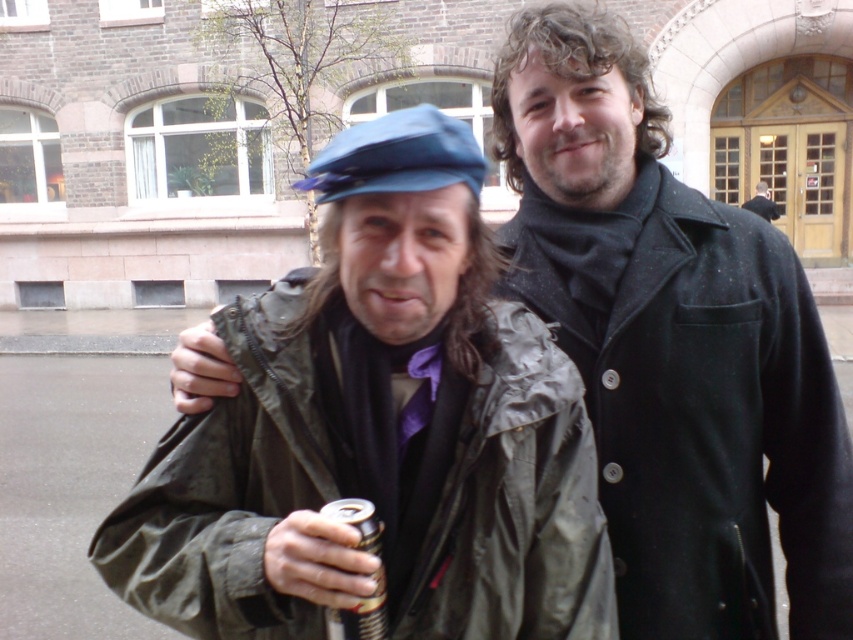
From the picture: Does olive-green fabric trench coat at center have a smaller size compared to dark gray wool coat at right?

Correct, olive-green fabric trench coat at center occupies less space than dark gray wool coat at right.

Between olive-green fabric trench coat at center and dark gray wool coat at right, which one has less height?

With less height is olive-green fabric trench coat at center.

Locate an element on the screen. The height and width of the screenshot is (640, 853). olive-green fabric trench coat at center is located at coordinates (519, 506).

Find the location of a particular element. The height and width of the screenshot is (640, 853). olive-green fabric trench coat at center is located at coordinates (519, 506).

Measure the distance from olive-green fabric trench coat at center to blue fabric cap at center.

The distance of olive-green fabric trench coat at center from blue fabric cap at center is 17.49 inches.

The height and width of the screenshot is (640, 853). What do you see at coordinates (519, 506) in the screenshot?
I see `olive-green fabric trench coat at center` at bounding box center [519, 506].

You are a GUI agent. You are given a task and a screenshot of the screen. Output one action in this format:
    pyautogui.click(x=<x>, y=<y>)
    Task: Click on the olive-green fabric trench coat at center
    
    Given the screenshot: What is the action you would take?
    pyautogui.click(x=519, y=506)

Measure the distance from metallic can at lower center to dark gray wool coat at right.

16.33 meters

The width and height of the screenshot is (853, 640). In order to click on metallic can at lower center in this screenshot , I will do `click(360, 616)`.